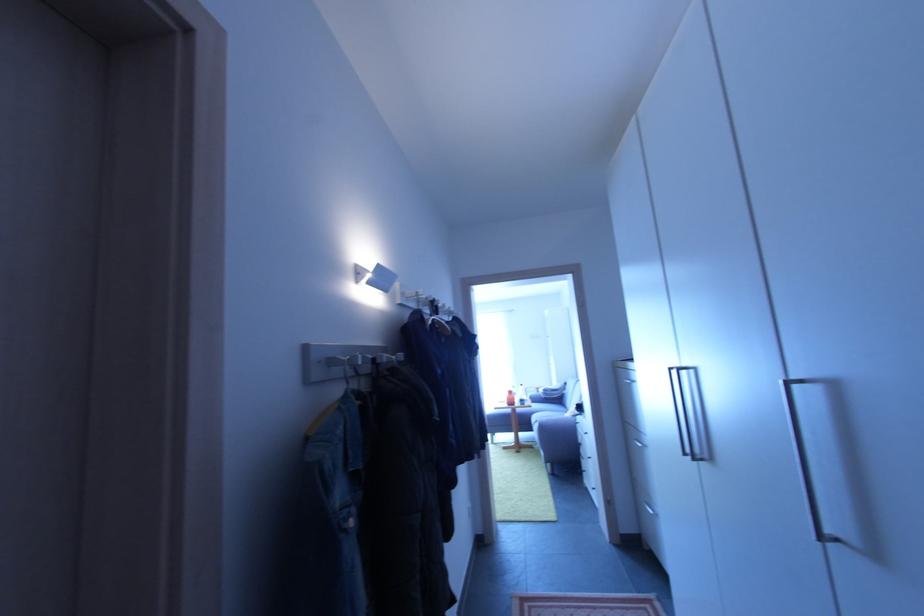
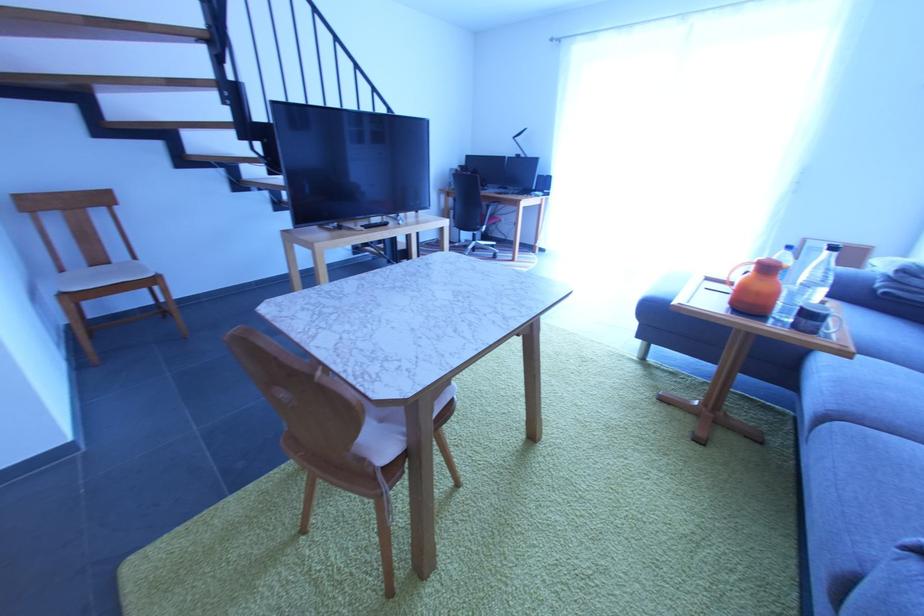
Find the pixel in the second image that matches pixel 529 407 in the first image.

(819, 334)